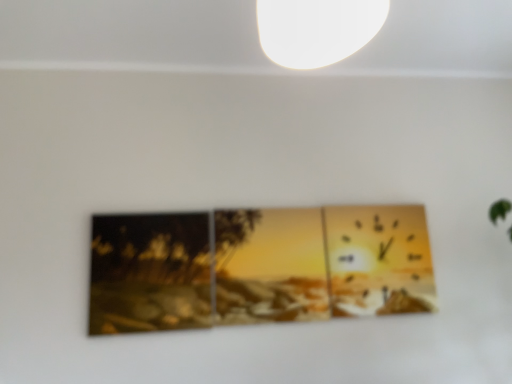
In order to face matte gold clock at upper right, should I rotate leftwards or rightwards?

You should rotate right by 16.417 degrees.

You are a GUI agent. You are given a task and a screenshot of the screen. Output one action in this format:
    pyautogui.click(x=<x>, y=<y>)
    Task: Click on the matte gold clock at upper right
    Image resolution: width=512 pixels, height=384 pixels.
    Given the screenshot: What is the action you would take?
    pyautogui.click(x=378, y=260)

What do you see at coordinates (378, 260) in the screenshot? I see `matte gold clock at upper right` at bounding box center [378, 260].

I want to click on matte gold clock at upper right, so click(x=378, y=260).